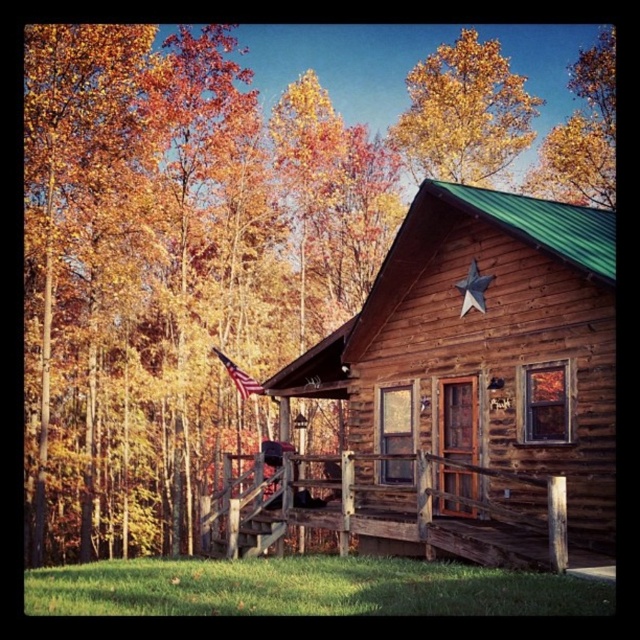
Question: Which of the following is the closest to the observer?

Choices:
 (A) (440, 120)
 (B) (346, 349)

Answer: (B)

Question: Estimate the real-world distances between objects in this image. Which object is farther from the rustic wood cabin at center?

Choices:
 (A) golden yellow leaves at upper center
 (B) american flag at center

Answer: (A)

Question: Can you confirm if rustic wood cabin at center is smaller than american flag at center?

Choices:
 (A) no
 (B) yes

Answer: (A)

Question: Does rustic wood cabin at center appear on the left side of golden yellow leaves at upper center?

Choices:
 (A) yes
 (B) no

Answer: (A)

Question: Can you confirm if golden yellow leaves at upper center is positioned to the left of american flag at center?

Choices:
 (A) yes
 (B) no

Answer: (B)

Question: Which of these objects is positioned farthest from the american flag at center?

Choices:
 (A) golden yellow leaves at upper center
 (B) rustic wood cabin at center

Answer: (A)